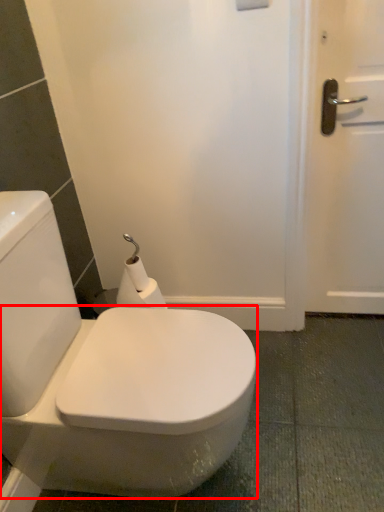
Question: From the image's perspective, where is bidet (annotated by the red box) located relative to toilet paper?

Choices:
 (A) above
 (B) below

Answer: (B)